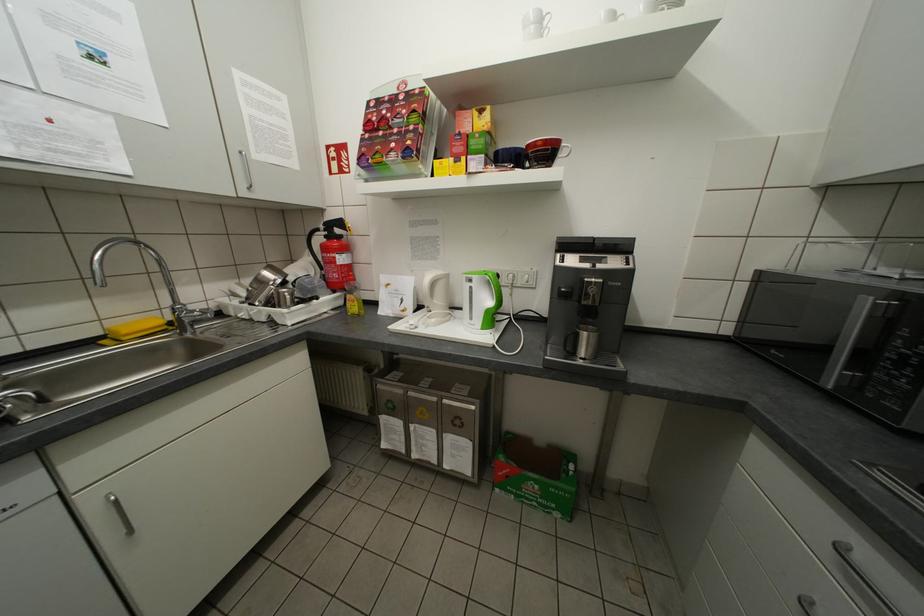
Identify the location of extinguisher handle. (313, 248).